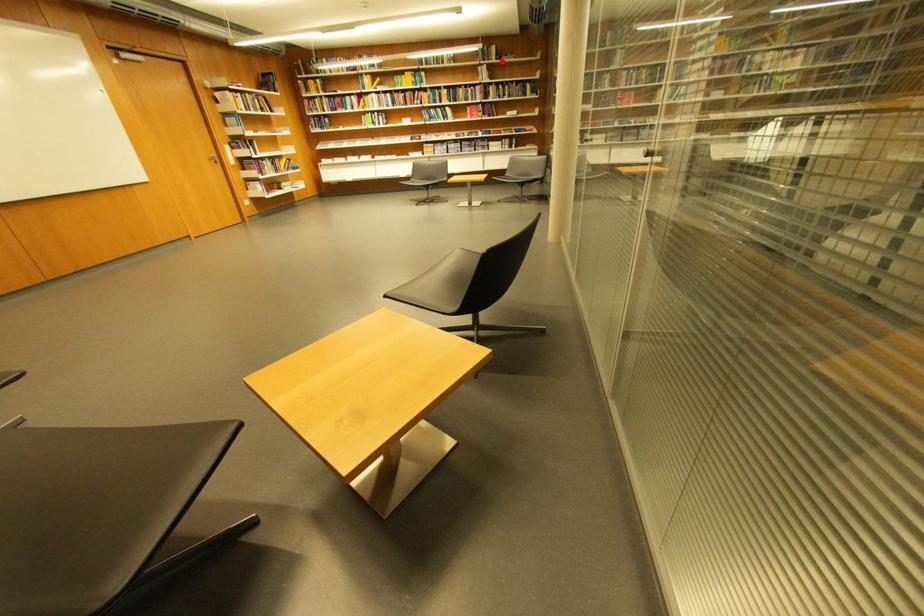
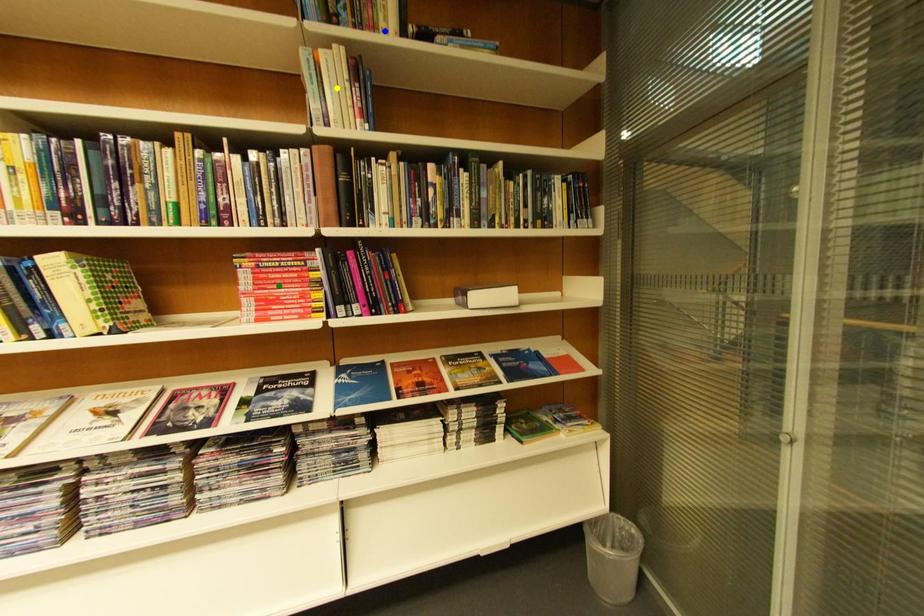
Question: I am providing you with two images of the same scene from different viewpoints. A red point is marked on the first image. You are given multiple points on the second image. Can you choose the point in image 2 that corresponds to the point in image 1?

Choices:
 (A) yellow point
 (B) green point
 (C) blue point

Answer: (C)